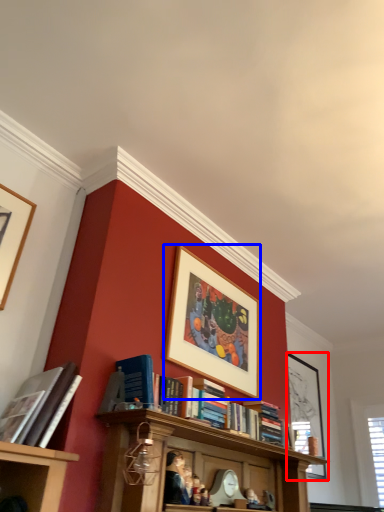
Question: Which of the following is the farthest to the observer, picture frame (highlighted by a red box) or picture frame (highlighted by a blue box)?

Choices:
 (A) picture frame
 (B) picture frame

Answer: (A)